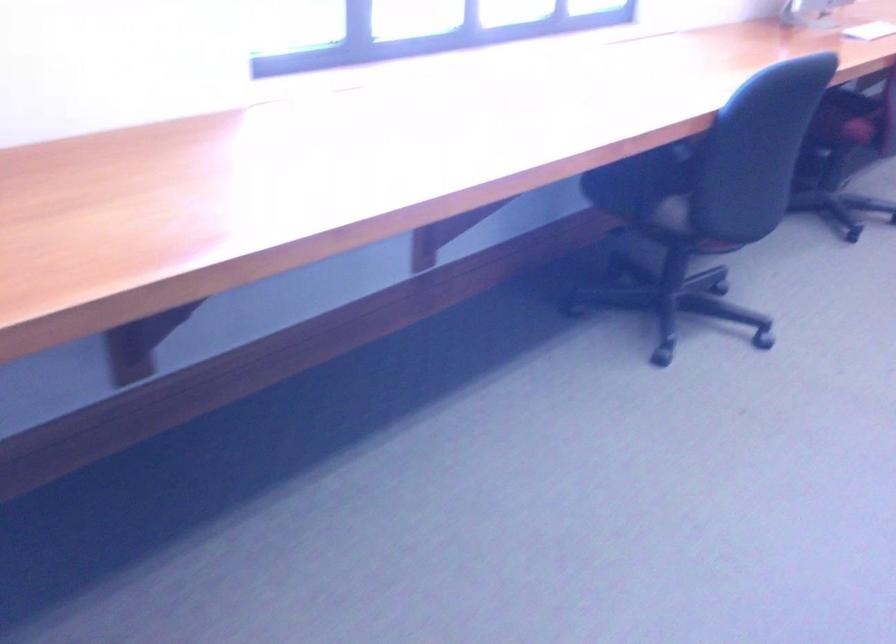
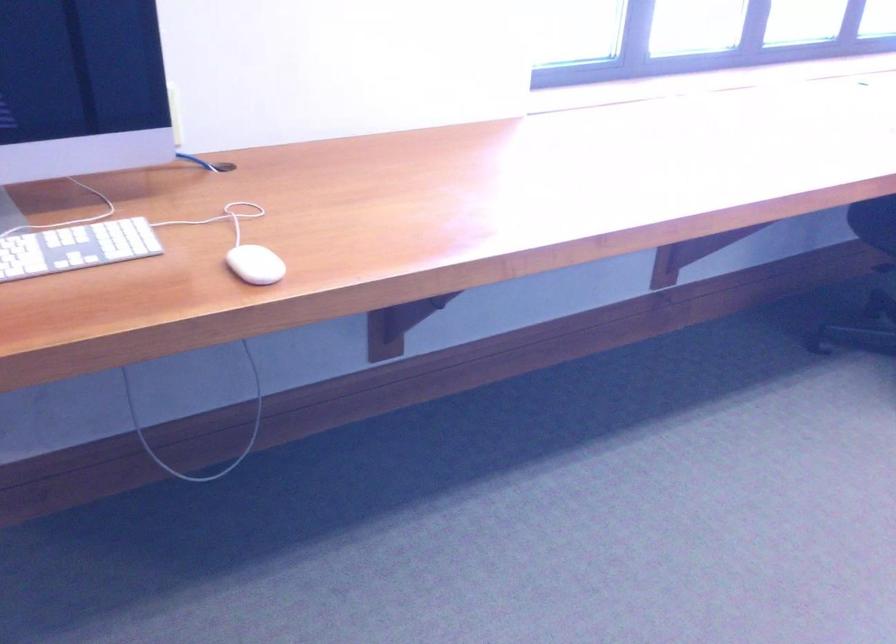
Question: The camera is either moving clockwise (left) or counter-clockwise (right) around the object. The first image is from the beginning of the video and the second image is from the end. Is the camera moving left or right when shooting the video?

Choices:
 (A) Left
 (B) Right

Answer: (B)